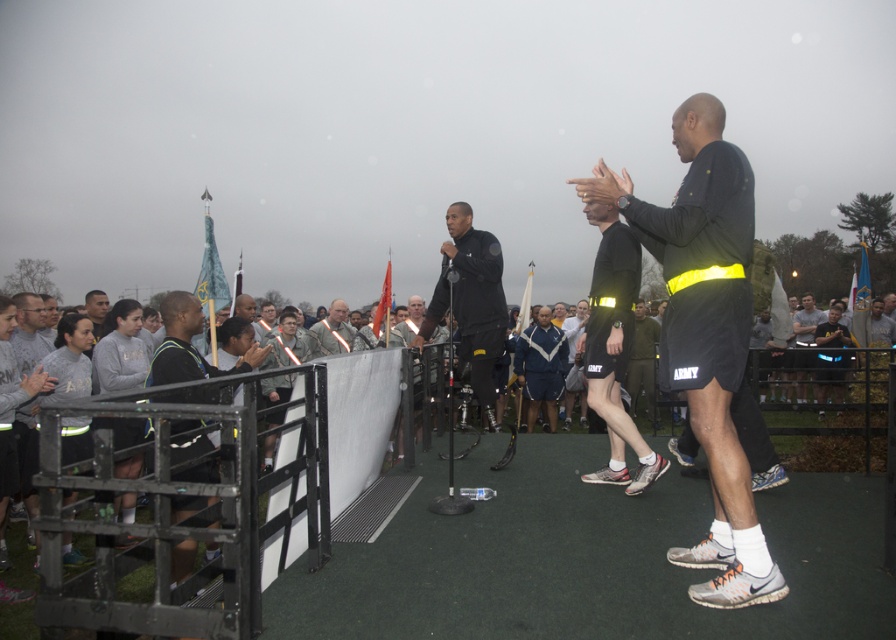
You are a photographer positioned at the edge of the stage. You need to capture a photo that includes both the black matte shorts at center and the army uniform at center. What is the minimum distance you should set your camera lens to ensure both subjects are in frame?

The black matte shorts at center and army uniform at center are 5.59 meters apart. To capture both in the same frame, the camera lens should be set to a focal length that can accommodate a subject distance of at least 5.59 meters apart.

You are a photographer at the event and want to capture a photo that includes both the black athletic wear at left and the black matte microphone at center. Based on their positions, which object should you focus on first to ensure both are in frame?

The black athletic wear at left is positioned on the left side of black matte microphone at center, so you should focus on the black athletic wear at left first to ensure both are in frame.